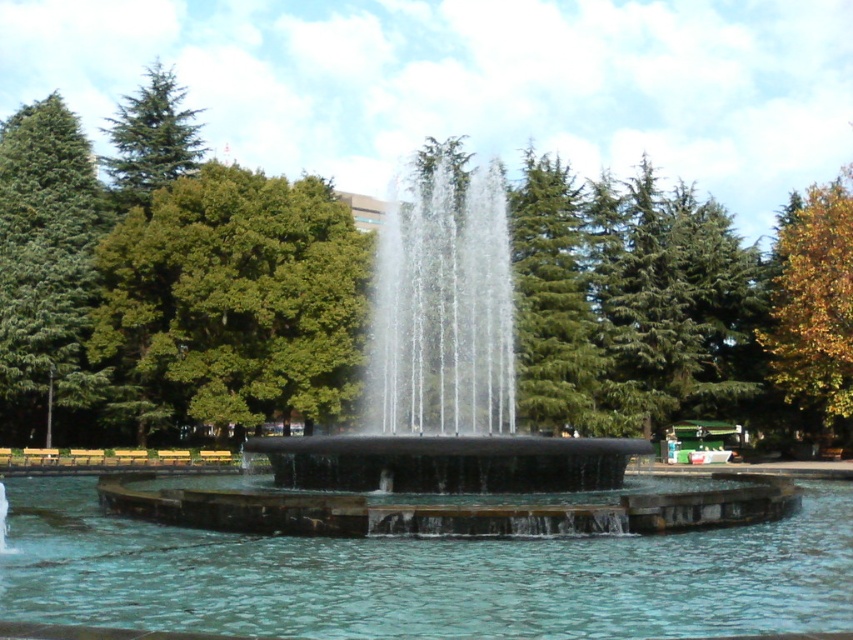
What do you see at coordinates (231, 300) in the screenshot?
I see `green leafy tree at center` at bounding box center [231, 300].

Looking at this image, who is shorter, green leafy tree at center or green coniferous tree at upper center?

green leafy tree at center

The height and width of the screenshot is (640, 853). Describe the element at coordinates (231, 300) in the screenshot. I see `green leafy tree at center` at that location.

The width and height of the screenshot is (853, 640). Find the location of `green leafy tree at center`. green leafy tree at center is located at coordinates (231, 300).

Who is positioned more to the left, clear water at center or green needle-like tree at upper left?

From the viewer's perspective, green needle-like tree at upper left appears more on the left side.

What do you see at coordinates (422, 577) in the screenshot?
I see `clear water at center` at bounding box center [422, 577].

Describe the element at coordinates (422, 577) in the screenshot. I see `clear water at center` at that location.

The width and height of the screenshot is (853, 640). What are the coordinates of `clear water at center` in the screenshot? It's located at (422, 577).

Between green leafy tree at center and black polished water at center, which one is positioned lower?

black polished water at center

Can you confirm if green leafy tree at center is thinner than black polished water at center?

No, green leafy tree at center is not thinner than black polished water at center.

The image size is (853, 640). What are the coordinates of `green leafy tree at center` in the screenshot? It's located at (231, 300).